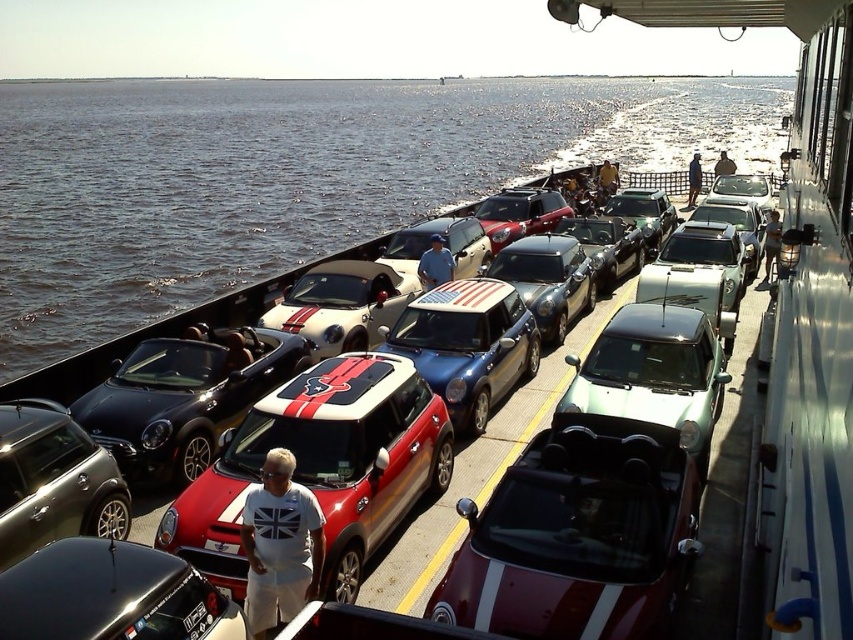
Who is positioned more to the right, red matte car at center or shiny metallic car at center?

shiny metallic car at center

Does point (432, 403) come in front of point (409, 540)?

That is False.

Identify the location of red matte car at center. (322, 467).

Where is `red matte car at center`? This screenshot has width=853, height=640. red matte car at center is located at coordinates (322, 467).

Based on the photo, is shiny red convertible at center to the left of shiny metallic car at center from the viewer's perspective?

Correct, you'll find shiny red convertible at center to the left of shiny metallic car at center.

Does point (483, 576) come farther from viewer compared to point (740, 396)?

No, (483, 576) is in front of (740, 396).

Where is `shiny red convertible at center`? This screenshot has width=853, height=640. shiny red convertible at center is located at coordinates (578, 536).

Is shiny red convertible at center below blue metallic car at center?

Correct, shiny red convertible at center is located below blue metallic car at center.

Does shiny red convertible at center have a larger size compared to blue metallic car at center?

No.

The image size is (853, 640). What are the coordinates of `shiny red convertible at center` in the screenshot? It's located at (578, 536).